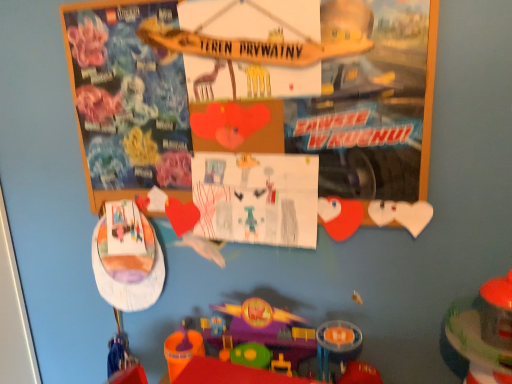
Question: Can matte plastic plate at left, placed as the first toy when sorted from left to right, be found inside translucent plastic toy at lower right, which is the first toy in right-to-left order?

Choices:
 (A) yes
 (B) no

Answer: (B)

Question: Is translucent plastic toy at lower right, which is the first toy in right-to-left order, bigger than matte plastic plate at left, placed as the first toy when sorted from left to right?

Choices:
 (A) yes
 (B) no

Answer: (A)

Question: From a real-world perspective, is translucent plastic toy at lower right, which is the first toy in right-to-left order, located beneath matte plastic plate at left, the 3th toy positioned from the right?

Choices:
 (A) no
 (B) yes

Answer: (B)

Question: Is translucent plastic toy at lower right, placed as the third toy when sorted from left to right, at the left side of matte plastic plate at left, the 3th toy positioned from the right?

Choices:
 (A) yes
 (B) no

Answer: (B)

Question: From the image's perspective, does translucent plastic toy at lower right, placed as the third toy when sorted from left to right, appear higher than matte plastic plate at left, the 3th toy positioned from the right?

Choices:
 (A) yes
 (B) no

Answer: (B)

Question: Considering the positions of point (172, 46) and point (117, 299), is point (172, 46) closer or farther from the camera than point (117, 299)?

Choices:
 (A) farther
 (B) closer

Answer: (B)

Question: Choose the correct answer: Is wooden sign at upper center inside matte plastic plate at left, placed as the first toy when sorted from left to right, or outside it?

Choices:
 (A) outside
 (B) inside

Answer: (A)

Question: Is wooden sign at upper center taller or shorter than matte plastic plate at left, the 3th toy positioned from the right?

Choices:
 (A) tall
 (B) short

Answer: (A)

Question: Based on their sizes in the image, would you say wooden sign at upper center is bigger or smaller than matte plastic plate at left, the 3th toy positioned from the right?

Choices:
 (A) big
 (B) small

Answer: (A)

Question: Visually, is colored paper drawing at center positioned to the left or to the right of matte plastic plate at left, placed as the first toy when sorted from left to right?

Choices:
 (A) left
 (B) right

Answer: (B)

Question: From a real-world perspective, is colored paper drawing at center positioned above or below matte plastic plate at left, placed as the first toy when sorted from left to right?

Choices:
 (A) below
 (B) above

Answer: (B)

Question: Is colored paper drawing at center in front of or behind matte plastic plate at left, the 3th toy positioned from the right, in the image?

Choices:
 (A) front
 (B) behind

Answer: (A)

Question: Is colored paper drawing at center bigger or smaller than matte plastic plate at left, the 3th toy positioned from the right?

Choices:
 (A) small
 (B) big

Answer: (A)

Question: Would you say colored paper drawing at center is to the left or to the right of translucent plastic toy at lower right, which is the first toy in right-to-left order, in the picture?

Choices:
 (A) right
 (B) left

Answer: (B)

Question: Is point (247, 180) positioned closer to the camera than point (494, 367)?

Choices:
 (A) farther
 (B) closer

Answer: (A)